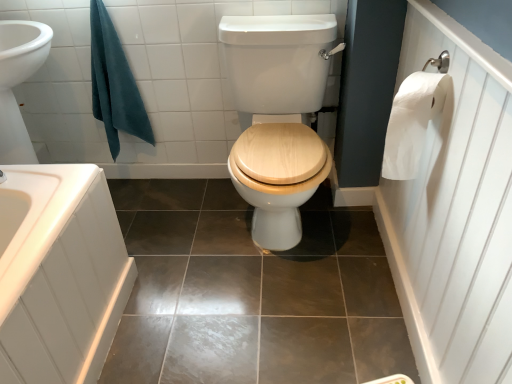
Question: Considering the positions of point (133, 97) and point (421, 96), is point (133, 97) closer or farther from the camera than point (421, 96)?

Choices:
 (A) farther
 (B) closer

Answer: (A)

Question: Relative to white paper at right, is teal cotton towel at upper left in front or behind?

Choices:
 (A) front
 (B) behind

Answer: (B)

Question: Which is farther from the white paper towel at right?

Choices:
 (A) shiny brown tile at center
 (B) white wood toilet seat at center
 (C) teal cotton towel at upper left
 (D) white paper at right

Answer: (C)

Question: Estimate the real-world distances between objects in this image. Which object is farther from the white paper at right?

Choices:
 (A) white wood toilet seat at center
 (B) teal cotton towel at upper left
 (C) white paper towel at right
 (D) shiny brown tile at center

Answer: (B)